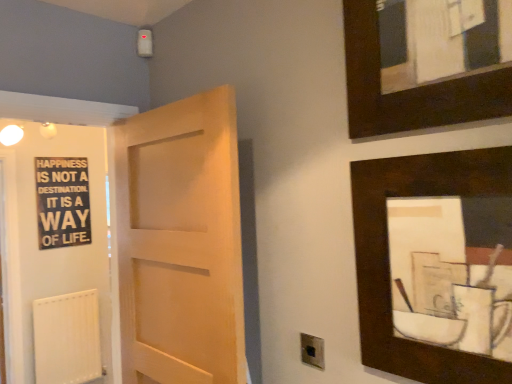
Question: From the image's perspective, is light wood door at center on top of black wood signboard at left?

Choices:
 (A) yes
 (B) no

Answer: (B)

Question: Is the surface of light wood door at center in direct contact with black wood signboard at left?

Choices:
 (A) yes
 (B) no

Answer: (B)

Question: Is light wood door at center smaller than black wood signboard at left?

Choices:
 (A) no
 (B) yes

Answer: (A)

Question: Is the position of light wood door at center more distant than that of black wood signboard at left?

Choices:
 (A) no
 (B) yes

Answer: (A)

Question: From a real-world perspective, is light wood door at center beneath black wood signboard at left?

Choices:
 (A) yes
 (B) no

Answer: (A)

Question: Can you confirm if light wood door at center is positioned to the left of black wood signboard at left?

Choices:
 (A) no
 (B) yes

Answer: (A)

Question: From the image's perspective, is white matte radiator at lower left on top of dark wood picture frame at upper right, marked as the first picture frame in a top-to-bottom arrangement?

Choices:
 (A) yes
 (B) no

Answer: (B)

Question: Could dark wood picture frame at upper right, positioned as the 2th picture frame in bottom-to-top order, be considered to be inside white matte radiator at lower left?

Choices:
 (A) no
 (B) yes

Answer: (A)

Question: Is white matte radiator at lower left wider than dark wood picture frame at upper right, marked as the first picture frame in a top-to-bottom arrangement?

Choices:
 (A) no
 (B) yes

Answer: (B)

Question: Considering the relative positions of white matte radiator at lower left and dark wood picture frame at upper right, positioned as the 2th picture frame in bottom-to-top order, in the image provided, is white matte radiator at lower left in front of dark wood picture frame at upper right, positioned as the 2th picture frame in bottom-to-top order,?

Choices:
 (A) yes
 (B) no

Answer: (B)

Question: Would you consider white matte radiator at lower left to be distant from dark wood picture frame at upper right, positioned as the 2th picture frame in bottom-to-top order?

Choices:
 (A) yes
 (B) no

Answer: (A)

Question: From a real-world perspective, is white matte radiator at lower left physically below dark wood picture frame at upper right, positioned as the 2th picture frame in bottom-to-top order?

Choices:
 (A) no
 (B) yes

Answer: (B)

Question: Is dark wood picture frame at upper right, which appears as the first picture frame when ordered from the bottom, next to dark wood picture frame at upper right, positioned as the 2th picture frame in bottom-to-top order, and touching it?

Choices:
 (A) no
 (B) yes

Answer: (A)